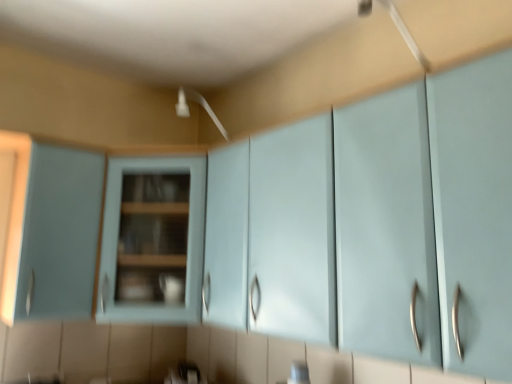
Question: In which direction should I rotate to look at matte blue cabinet at center, which is counted as the first cabinetry, starting from the right?

Choices:
 (A) left
 (B) right

Answer: (A)

Question: Is matte light blue cabinet at left, which ranks as the first cabinetry in left-to-right order, smaller than matte blue cabinet at center, which is counted as the first cabinetry, starting from the right?

Choices:
 (A) no
 (B) yes

Answer: (B)

Question: Could you tell me if matte light blue cabinet at left, the second cabinetry from the right, is turned towards matte blue cabinet at center, the second cabinetry when ordered from left to right?

Choices:
 (A) yes
 (B) no

Answer: (B)

Question: Is matte light blue cabinet at left, the second cabinetry from the right, with matte blue cabinet at center, the second cabinetry when ordered from left to right?

Choices:
 (A) no
 (B) yes

Answer: (A)

Question: Can you confirm if matte light blue cabinet at left, the second cabinetry from the right, is positioned to the right of matte blue cabinet at center, which is counted as the first cabinetry, starting from the right?

Choices:
 (A) yes
 (B) no

Answer: (B)

Question: From the image's perspective, is matte light blue cabinet at left, which ranks as the first cabinetry in left-to-right order, above matte blue cabinet at center, the second cabinetry when ordered from left to right?

Choices:
 (A) no
 (B) yes

Answer: (B)

Question: Are matte light blue cabinet at left, the second cabinetry from the right, and matte blue cabinet at center, the second cabinetry when ordered from left to right, far apart?

Choices:
 (A) no
 (B) yes

Answer: (A)

Question: Is matte light blue cabinet at left, which ranks as the first cabinetry in left-to-right order, a part of matte blue cabinet at center, which is counted as the first cabinetry, starting from the right?

Choices:
 (A) no
 (B) yes

Answer: (A)

Question: Is matte blue cabinet at center, the second cabinetry when ordered from left to right, not within matte light blue cabinet at left, the second cabinetry from the right?

Choices:
 (A) yes
 (B) no

Answer: (A)

Question: Can you confirm if matte blue cabinet at center, the second cabinetry when ordered from left to right, is positioned to the left of matte light blue cabinet at left, the second cabinetry from the right?

Choices:
 (A) yes
 (B) no

Answer: (B)

Question: From the image's perspective, is matte blue cabinet at center, which is counted as the first cabinetry, starting from the right, on top of matte light blue cabinet at left, which ranks as the first cabinetry in left-to-right order?

Choices:
 (A) yes
 (B) no

Answer: (B)

Question: Does matte blue cabinet at center, the second cabinetry when ordered from left to right, have a lesser width compared to matte light blue cabinet at left, the second cabinetry from the right?

Choices:
 (A) no
 (B) yes

Answer: (A)

Question: Is matte blue cabinet at center, which is counted as the first cabinetry, starting from the right, with matte light blue cabinet at left, which ranks as the first cabinetry in left-to-right order?

Choices:
 (A) yes
 (B) no

Answer: (B)

Question: Looking at the image, does matte light blue cabinet at left, the second cabinetry from the right, seem bigger or smaller compared to matte blue cabinet at center, the second cabinetry when ordered from left to right?

Choices:
 (A) big
 (B) small

Answer: (B)